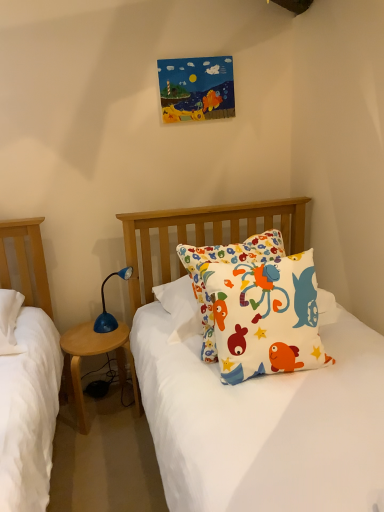
What is the approximate width of white cotton pillow with colorful fish designs at center?

It is 10.11 inches.

Where is `white cotton pillow with colorful fish designs at center`? The height and width of the screenshot is (512, 384). white cotton pillow with colorful fish designs at center is located at coordinates (260, 307).

What is the approximate width of blue plastic lamp at lower left?

It is 4.48 inches.

Identify the location of white cotton pillow with colorful fish designs at center. (260, 307).

From a real-world perspective, is wooden nightstand at left positioned above or below white cotton pillow with colorful fish designs at center?

wooden nightstand at left is below white cotton pillow with colorful fish designs at center.

Based on the photo, can you tell me how much wooden nightstand at left and white cotton pillow with colorful fish designs at center differ in facing direction?

The angular difference between wooden nightstand at left and white cotton pillow with colorful fish designs at center is 17.5 degrees.

Is wooden nightstand at left turned away from white cotton pillow with colorful fish designs at center?

wooden nightstand at left is not turned away from white cotton pillow with colorful fish designs at center.

Is point (125, 356) behind point (297, 313)?

Yes.

Does point (239, 248) appear closer or farther from the camera than point (107, 315)?

Point (239, 248).

Are white cotton pillow with colorful fish designs at center and blue plastic lamp at lower left far apart?

That's not correct — white cotton pillow with colorful fish designs at center is a little close to blue plastic lamp at lower left.

From the picture: What's the angular difference between white cotton pillow with colorful fish designs at center and blue plastic lamp at lower left's facing directions?

They differ by 34.7 degrees in their facing directions.

Can you confirm if white cotton pillow with colorful fish designs at center is shorter than wooden nightstand at left?

Incorrect, the height of white cotton pillow with colorful fish designs at center does not fall short of that of wooden nightstand at left.

Looking at this image, is white cotton pillow with colorful fish designs at center facing towards wooden nightstand at left?

No.

Between white cotton pillow with colorful fish designs at center and wooden nightstand at left, which one appears on the right side from the viewer's perspective?

white cotton pillow with colorful fish designs at center.

Is white cotton pillow with colorful fish designs at center positioned far away from wooden nightstand at left?

No, white cotton pillow with colorful fish designs at center is not far from wooden nightstand at left.

Which is behind, point (74, 359) or point (106, 281)?

The point (106, 281) is behind.

Considering the relative positions of wooden nightstand at left and blue plastic lamp at lower left in the image provided, is wooden nightstand at left to the right of blue plastic lamp at lower left from the viewer's perspective?

In fact, wooden nightstand at left is to the left of blue plastic lamp at lower left.

Is wooden nightstand at left bigger than blue plastic lamp at lower left?

Indeed, wooden nightstand at left has a larger size compared to blue plastic lamp at lower left.

From the image's perspective, between wooden nightstand at left and blue plastic lamp at lower left, which one is located above?

blue plastic lamp at lower left appears higher in the image.

Based on the photo, from the image's perspective, between blue plastic lamp at lower left and wooden nightstand at left, which one is located above?

blue plastic lamp at lower left, from the image's perspective.

Which is behind, point (125, 277) or point (105, 348)?

The point (125, 277) is more distant.

Consider the image. Is blue plastic lamp at lower left bigger or smaller than wooden nightstand at left?

blue plastic lamp at lower left is smaller than wooden nightstand at left.

How many degrees apart are the facing directions of blue plastic lamp at lower left and wooden nightstand at left?

The angle between the facing direction of blue plastic lamp at lower left and the facing direction of wooden nightstand at left is 52.2 degrees.

Is blue plastic lamp at lower left thinner than white cotton pillow with colorful fish designs at center?

Indeed, blue plastic lamp at lower left has a lesser width compared to white cotton pillow with colorful fish designs at center.

Between blue plastic lamp at lower left and white cotton pillow with colorful fish designs at center, which one appears on the right side from the viewer's perspective?

white cotton pillow with colorful fish designs at center.

Is point (114, 273) more distant than point (238, 266)?

Yes, point (114, 273) is behind point (238, 266).

Where is `nightstand to the left of white cotton pillow with colorful fish designs at center`? This screenshot has width=384, height=512. nightstand to the left of white cotton pillow with colorful fish designs at center is located at coordinates (94, 355).

In order to click on pillow lying on the right of blue plastic lamp at lower left in this screenshot , I will do `click(260, 307)`.

When comparing their distances from blue plastic lamp at lower left, does white cotton pillow with colorful fish designs at center or wooden nightstand at left seem closer?

Based on the image, wooden nightstand at left appears to be nearer to blue plastic lamp at lower left.

When comparing their distances from white cotton pillow with colorful fish designs at center, does blue plastic lamp at lower left or wooden nightstand at left seem closer?

Based on the image, blue plastic lamp at lower left appears to be nearer to white cotton pillow with colorful fish designs at center.

From the image, which object appears to be farther from wooden nightstand at left, white cotton pillow with colorful fish designs at center or blue plastic lamp at lower left?

Among the two, white cotton pillow with colorful fish designs at center is located further to wooden nightstand at left.

From the image, which object appears to be nearer to white cotton pillow with colorful fish designs at center, wooden nightstand at left or blue plastic lamp at lower left?

Among the two, blue plastic lamp at lower left is located nearer to white cotton pillow with colorful fish designs at center.

Which object lies nearer to the anchor point blue plastic lamp at lower left, wooden nightstand at left or white cotton pillow with colorful fish designs at center?

The object closer to blue plastic lamp at lower left is wooden nightstand at left.

Estimate the real-world distances between objects in this image. Which object is further from wooden nightstand at left, blue plastic lamp at lower left or white cotton pillow with colorful fish designs at center?

white cotton pillow with colorful fish designs at center is positioned further to the anchor wooden nightstand at left.

Identify the location of lamp located between wooden nightstand at left and white cotton pillow with colorful fish designs at center in the left-right direction. (105, 308).